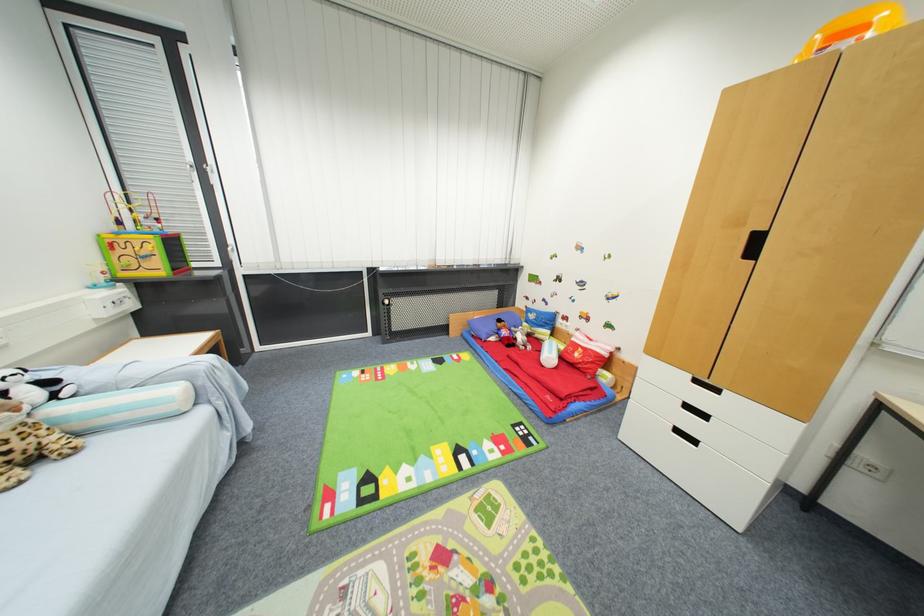
At what (x,y) coordinates should I click in order to perform the action: click on white plastic bottle. Please return your answer as a coordinate pair (x, y). This screenshot has height=616, width=924. Looking at the image, I should click on (549, 353).